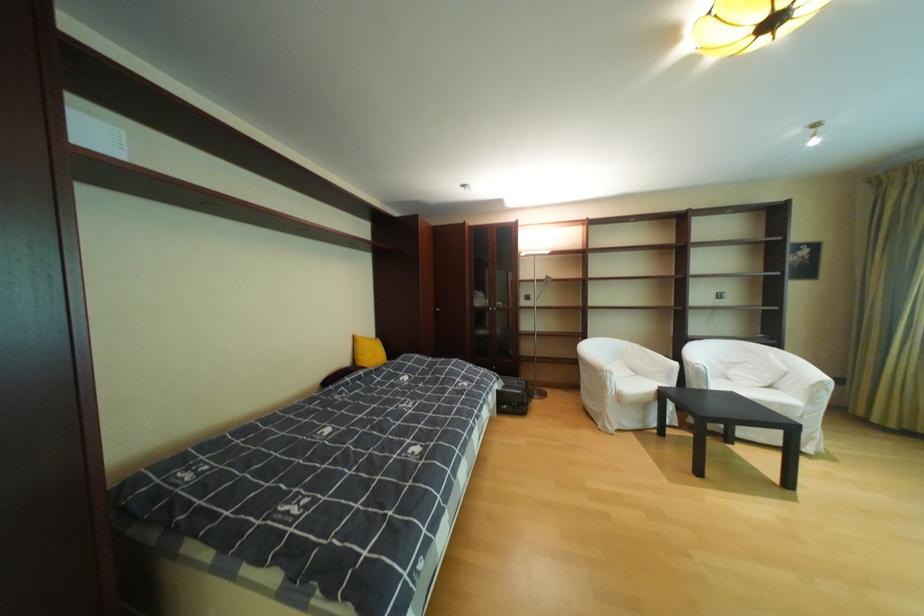
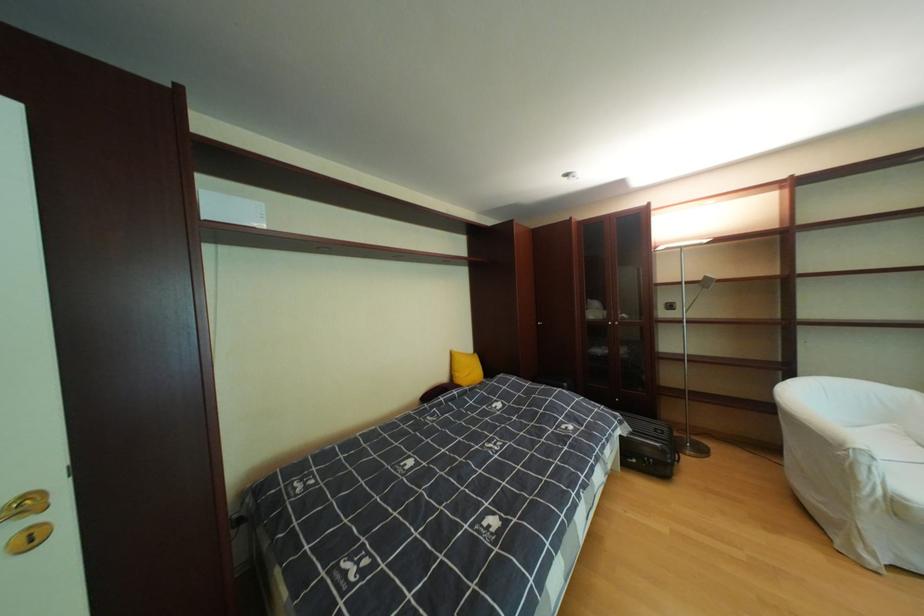
Question: Based on the continuous images, in which direction is the camera rotating? Reply with the corresponding letter.

Choices:
 (A) Left
 (B) Right
 (C) Up
 (D) Down

Answer: (A)